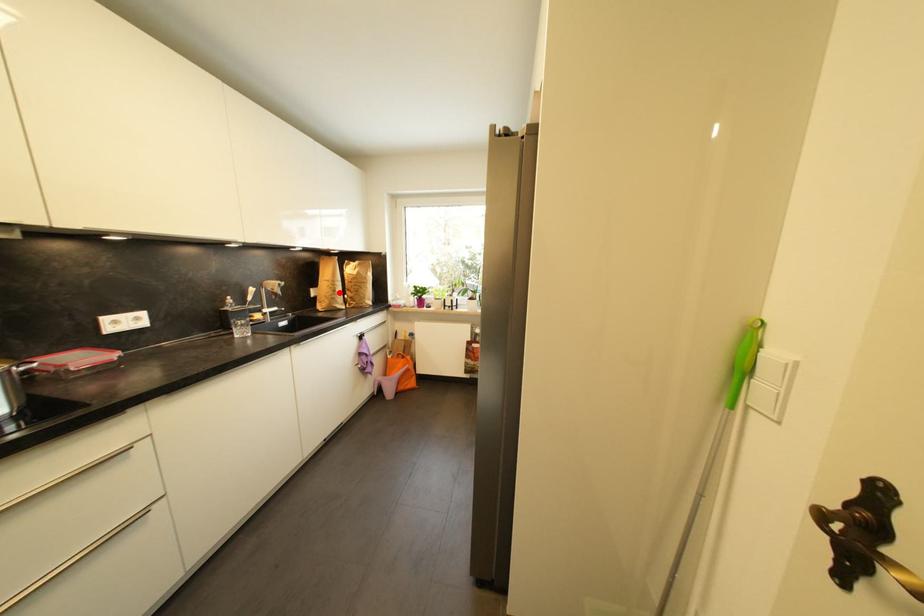
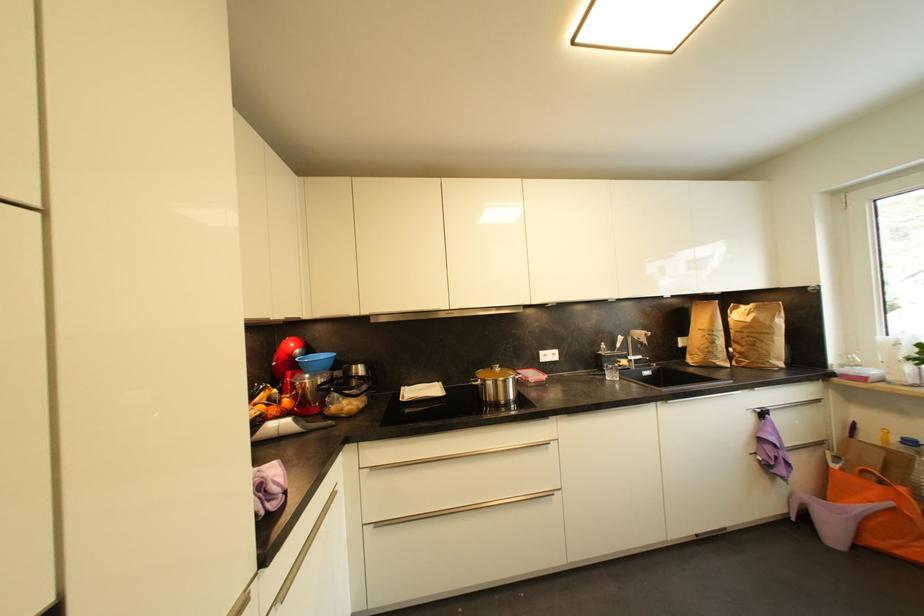
Find the pixel in the second image that matches the highlighted location in the first image.

(718, 345)